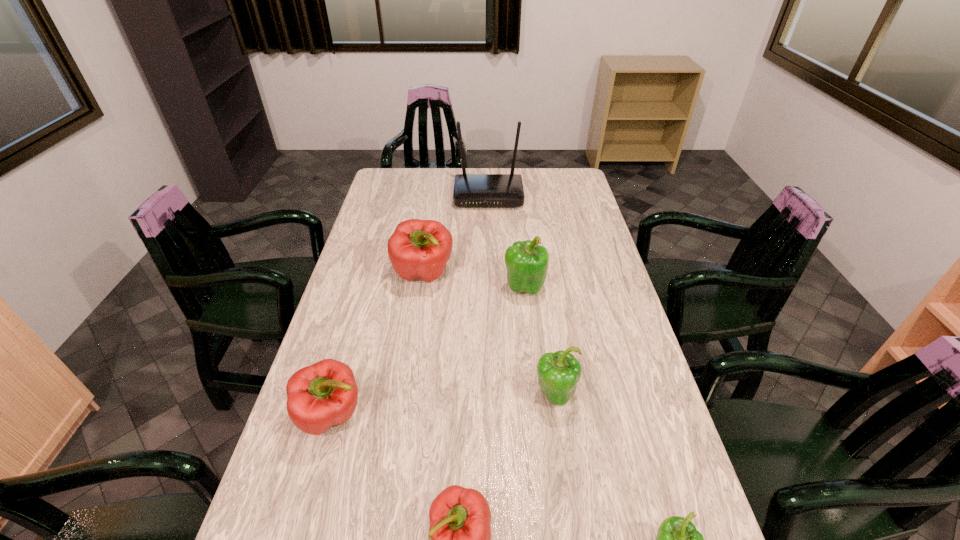
Image resolution: width=960 pixels, height=540 pixels. Find the location of `free spot located on the front of the second nearest pink bell pepper`. free spot located on the front of the second nearest pink bell pepper is located at coordinates (306, 506).

Find the location of a particular element. This screenshot has width=960, height=540. object that is at the far edge is located at coordinates (470, 190).

Image resolution: width=960 pixels, height=540 pixels. I want to click on free space at the far edge, so click(523, 170).

Locate an element on the screen. The width and height of the screenshot is (960, 540). free region at the left edge of the desktop is located at coordinates point(389,275).

You are a GUI agent. You are given a task and a screenshot of the screen. Output one action in this format:
    pyautogui.click(x=<x>, y=<y>)
    Task: Click on the vacant space at the right edge of the desktop
    
    Given the screenshot: What is the action you would take?
    pyautogui.click(x=612, y=275)

Where is `blank space at the far left corner`? The height and width of the screenshot is (540, 960). blank space at the far left corner is located at coordinates (387, 183).

Locate an element on the screen. vacant point at the far right corner is located at coordinates (553, 168).

Identify the location of free space that is in between the farthest pink bell pepper and the second biggest pink bell pepper. Image resolution: width=960 pixels, height=540 pixels. (377, 345).

You are a GUI agent. You are given a task and a screenshot of the screen. Output one action in this format:
    pyautogui.click(x=<x>, y=<y>)
    Task: Click on the vacant region between the router and the biggest pink bell pepper
    This screenshot has height=540, width=960.
    Given the screenshot: What is the action you would take?
    pyautogui.click(x=456, y=235)

Locate an element on the screen. The image size is (960, 540). empty space between the second nearest pink bell pepper and the farthest green bell pepper is located at coordinates (428, 351).